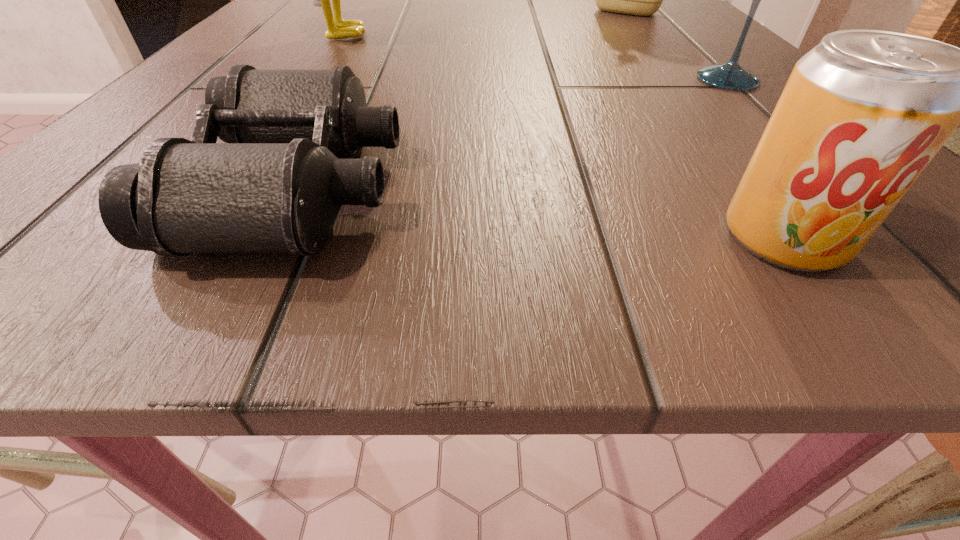
Where is `object positioned at the far left corner`? object positioned at the far left corner is located at coordinates pyautogui.click(x=337, y=28).

This screenshot has height=540, width=960. In order to click on object that is at the near left corner in this screenshot , I will do `click(276, 186)`.

Find the location of a particular element. This screenshot has width=960, height=540. object present at the far right corner is located at coordinates (641, 0).

Find the location of a particular element. object at the near right corner is located at coordinates (863, 113).

Where is `vacant space at the far edge`? The height and width of the screenshot is (540, 960). vacant space at the far edge is located at coordinates (427, 37).

Locate an element on the screen. This screenshot has height=540, width=960. vacant space at the near edge is located at coordinates (615, 294).

Locate an element on the screen. Image resolution: width=960 pixels, height=540 pixels. vacant space at the left edge of the desktop is located at coordinates (304, 60).

At what (x,y) coordinates should I click in order to perform the action: click on vacant space at the right edge. Please return your answer as a coordinate pair (x, y). This screenshot has height=540, width=960. Looking at the image, I should click on (725, 146).

At what (x,y) coordinates should I click in order to perform the action: click on vacant position at the far right corner of the desktop. Please return your answer as a coordinate pair (x, y). The height and width of the screenshot is (540, 960). Looking at the image, I should click on (644, 19).

Where is `free space that is in between the tallest object and the pop (soda)`? Image resolution: width=960 pixels, height=540 pixels. free space that is in between the tallest object and the pop (soda) is located at coordinates (561, 136).